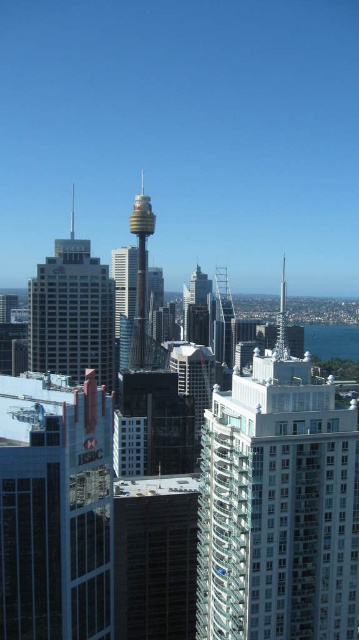
Between glassy reflective building at center and matte gray skyscraper at center, which one appears on the left side from the viewer's perspective?

Positioned to the left is glassy reflective building at center.

Image resolution: width=359 pixels, height=640 pixels. What do you see at coordinates (54, 508) in the screenshot?
I see `glassy reflective building at center` at bounding box center [54, 508].

Is point (40, 502) closer to viewer compared to point (59, 285)?

Yes, it is.

Locate an element on the screen. This screenshot has width=359, height=640. glassy reflective building at center is located at coordinates coord(54,508).